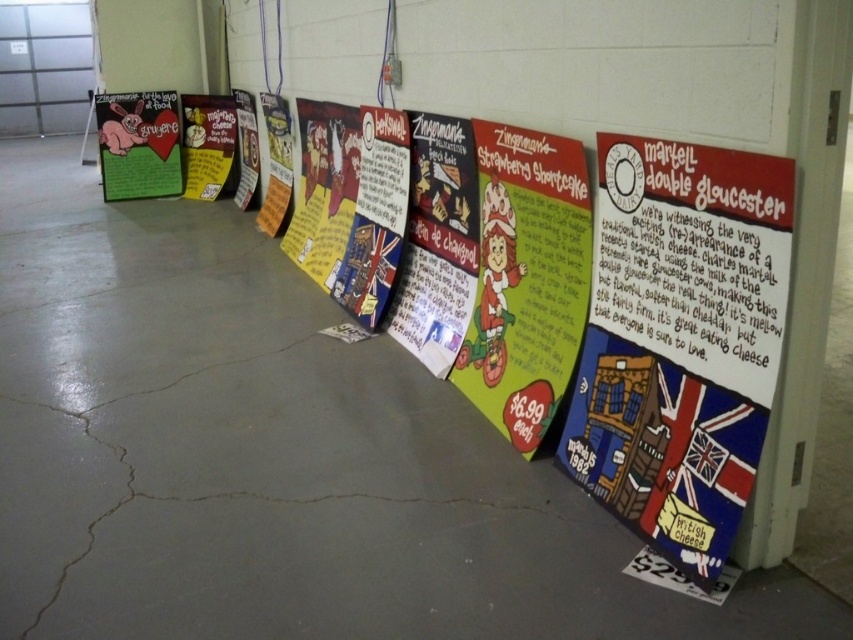
Question: Which of the following is the closest to the observer?

Choices:
 (A) (581, 476)
 (B) (189, 118)
 (C) (148, 145)

Answer: (A)

Question: Based on their relative distances, which object is nearer to the matte red poster at center right?

Choices:
 (A) matte green poster at center
 (B) matte yellow poster at center

Answer: (A)

Question: Is matte green poster at center behind matte green poster at upper left?

Choices:
 (A) no
 (B) yes

Answer: (A)

Question: Estimate the real-world distances between objects in this image. Which object is closer to the matte red poster at center right?

Choices:
 (A) matte green poster at center
 (B) matte green poster at upper left

Answer: (A)

Question: Does matte red poster at center right appear under matte green poster at center?

Choices:
 (A) yes
 (B) no

Answer: (A)

Question: Can you confirm if matte red poster at center right is positioned below matte green poster at center?

Choices:
 (A) yes
 (B) no

Answer: (A)